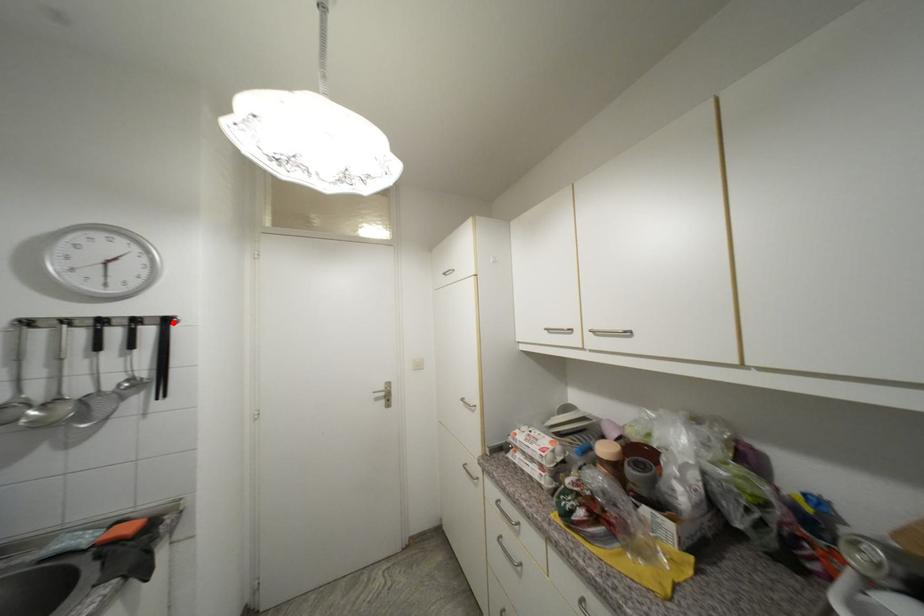
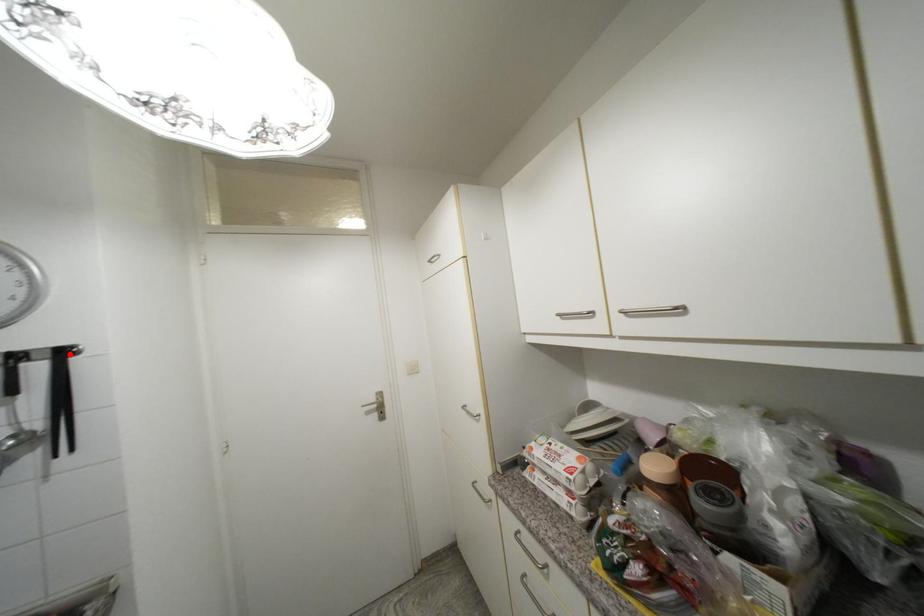
I am providing you with two images of the same scene from different viewpoints. A red point is marked on the first image and another point is marked on the second image. Is the red point in image1 aligned with the point shown in image2?

Yes